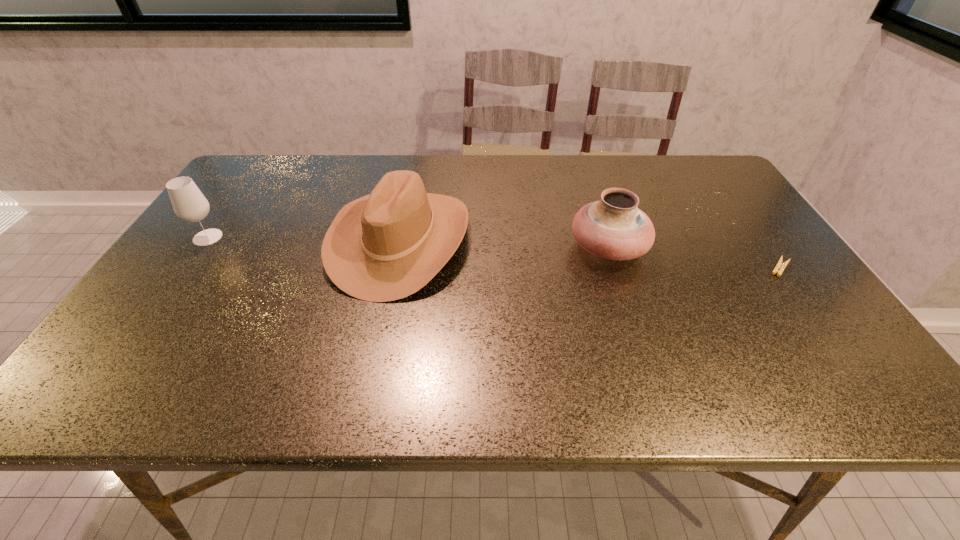
Where is `unoccupied area between the cowboy hat and the pottery`? unoccupied area between the cowboy hat and the pottery is located at coordinates (504, 244).

Locate an element on the screen. The width and height of the screenshot is (960, 540). free point between the leftmost object and the rightmost object is located at coordinates (493, 253).

You are a GUI agent. You are given a task and a screenshot of the screen. Output one action in this format:
    pyautogui.click(x=<x>, y=<y>)
    Task: Click on the free spot between the cowboy hat and the glass
    The width and height of the screenshot is (960, 540).
    Given the screenshot: What is the action you would take?
    pyautogui.click(x=304, y=239)

Locate an element on the screen. This screenshot has width=960, height=540. free point between the third object from right to left and the pottery is located at coordinates (504, 244).

The height and width of the screenshot is (540, 960). I want to click on blank region between the rightmost object and the pottery, so click(x=694, y=258).

Locate an element on the screen. This screenshot has width=960, height=540. vacant area that lies between the leftmost object and the cowboy hat is located at coordinates (304, 239).

The width and height of the screenshot is (960, 540). I want to click on unoccupied position between the cowboy hat and the glass, so click(x=304, y=239).

Locate an element on the screen. Image resolution: width=960 pixels, height=540 pixels. object that is the third closest to the second object from left to right is located at coordinates (780, 264).

Locate which object is the third closest to the rightmost object. Please provide its 2D coordinates. Your answer should be formatted as a tuple, i.e. [(x, y)], where the tuple contains the x and y coordinates of a point satisfying the conditions above.

[(189, 204)]

Locate an element on the screen. This screenshot has width=960, height=540. free spot that satisfies the following two spatial constraints: 1. on the front side of the cowboy hat; 2. on the left side of the second object from right to left is located at coordinates (398, 248).